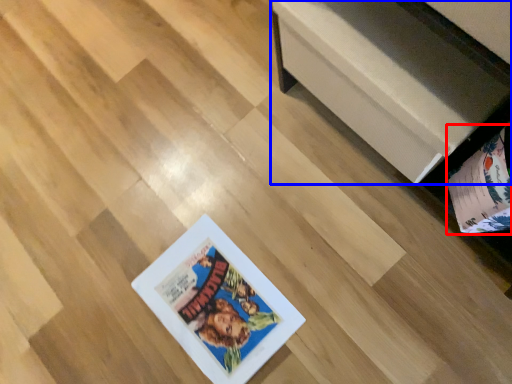
Question: Which of the following is the farthest to the observer, album (highlighted by a red box) or furniture (highlighted by a blue box)?

Choices:
 (A) album
 (B) furniture

Answer: (B)